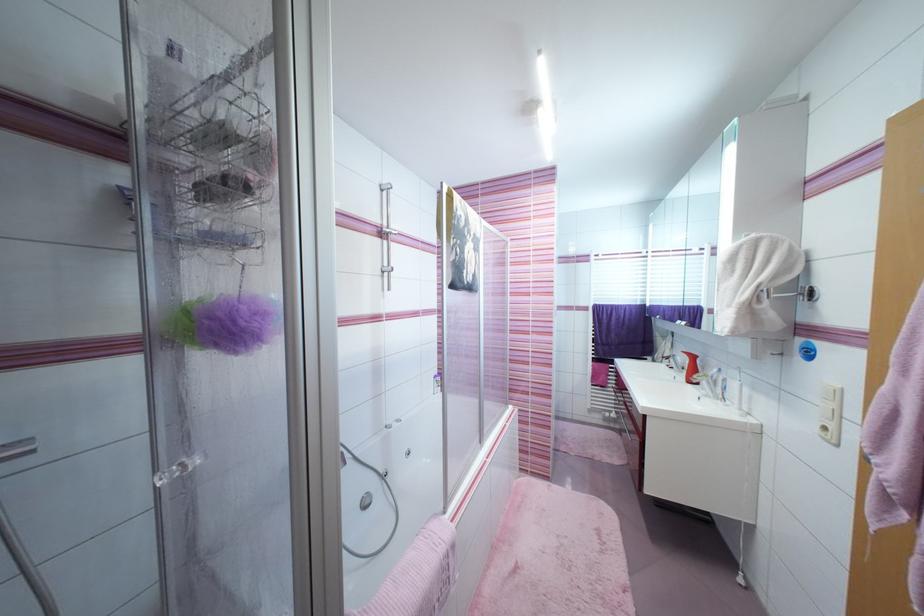
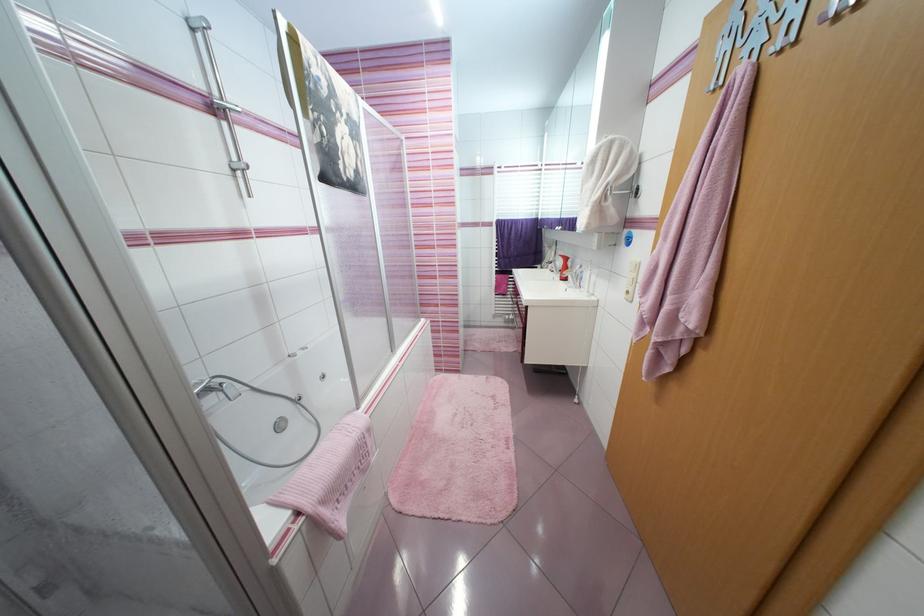
Question: Which direction would the cameraman need to move to produce the second image? Reply with the corresponding letter.

Choices:
 (A) Left
 (B) Right
 (C) Forward
 (D) Backward

Answer: (B)